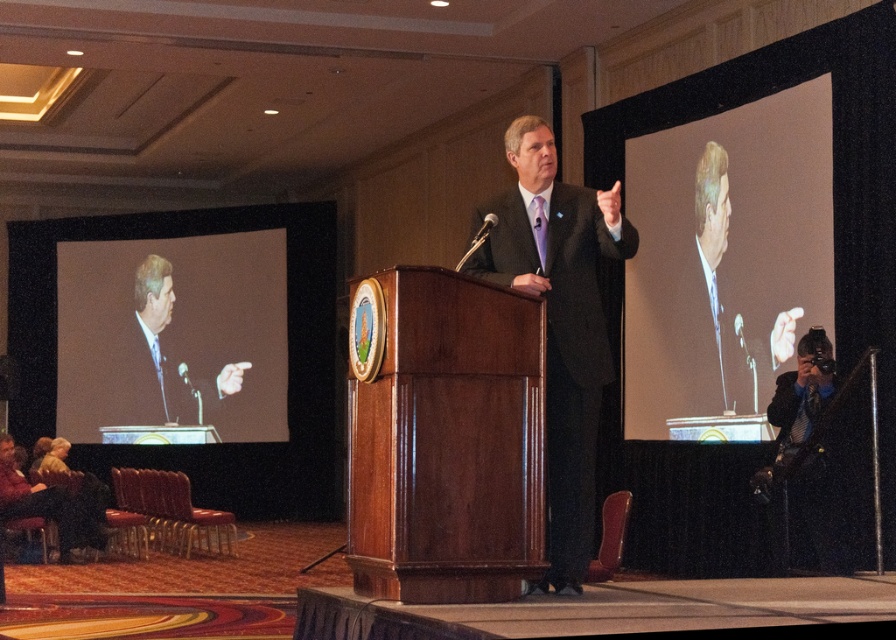
You are a photographer at the event and want to capture the speaker using the black leather camera at right. Can you determine if the camera is larger than the matte black suit at left?

The black leather camera at right has a larger size compared to matte black suit at left, so yes, the camera is larger than the matte black suit at left.

You are an event planner organizing a photoshoot for a fashion show. You need to position two models wearing the dark gray suit at center and the matte black suit at left. According to the image, which model should be placed higher up in the photo to maintain the original composition?

The dark gray suit at center should be placed higher up in the photo because it is located above the matte black suit at left in the original image.